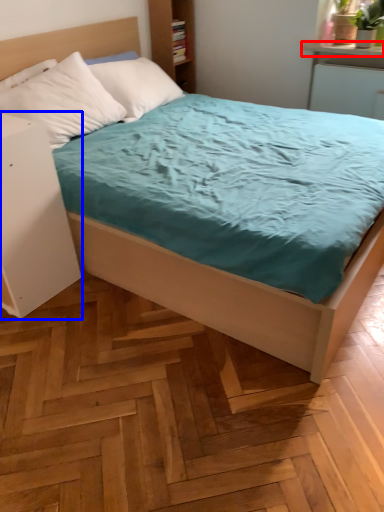
Question: Which object appears closest to the camera in this image, window sill (highlighted by a red box) or nightstand (highlighted by a blue box)?

Choices:
 (A) window sill
 (B) nightstand

Answer: (B)